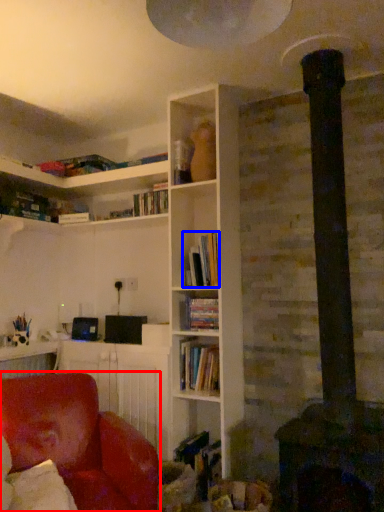
Question: Which object is further to the camera taking this photo, chair (highlighted by a red box) or book (highlighted by a blue box)?

Choices:
 (A) chair
 (B) book

Answer: (B)